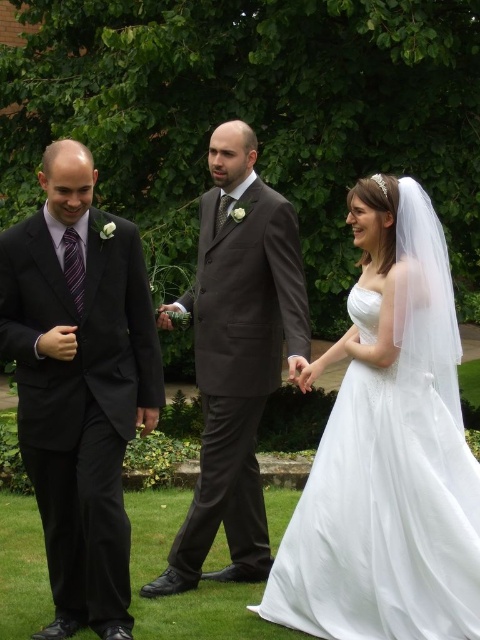
Question: Does black satin suit at left appear over white satin dress at center?

Choices:
 (A) yes
 (B) no

Answer: (A)

Question: Is white satin dress at center below dark gray suit at center?

Choices:
 (A) yes
 (B) no

Answer: (A)

Question: Which of the following is the farthest from the observer?

Choices:
 (A) dark gray suit at center
 (B) black satin suit at left
 (C) white satin dress at center
 (D) green grass at lower center

Answer: (A)

Question: Observing the image, what is the correct spatial positioning of black satin suit at left in reference to green grass at lower center?

Choices:
 (A) above
 (B) below

Answer: (A)

Question: Which is farther from the white satin dress at center?

Choices:
 (A) black satin suit at left
 (B) green grass at lower center

Answer: (A)

Question: Which is farther from the black satin suit at left?

Choices:
 (A) green grass at lower center
 (B) dark gray suit at center
 (C) white satin dress at center

Answer: (A)